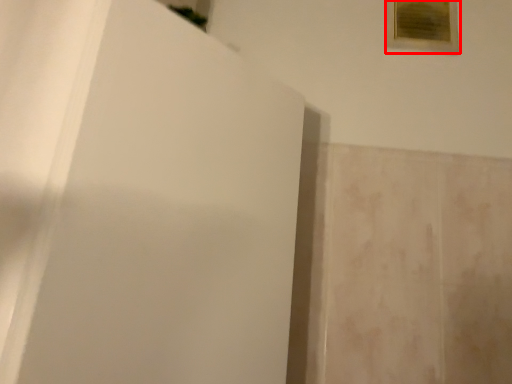
Question: Where is picture frame (annotated by the red box) located in relation to screen door in the image?

Choices:
 (A) right
 (B) left

Answer: (A)